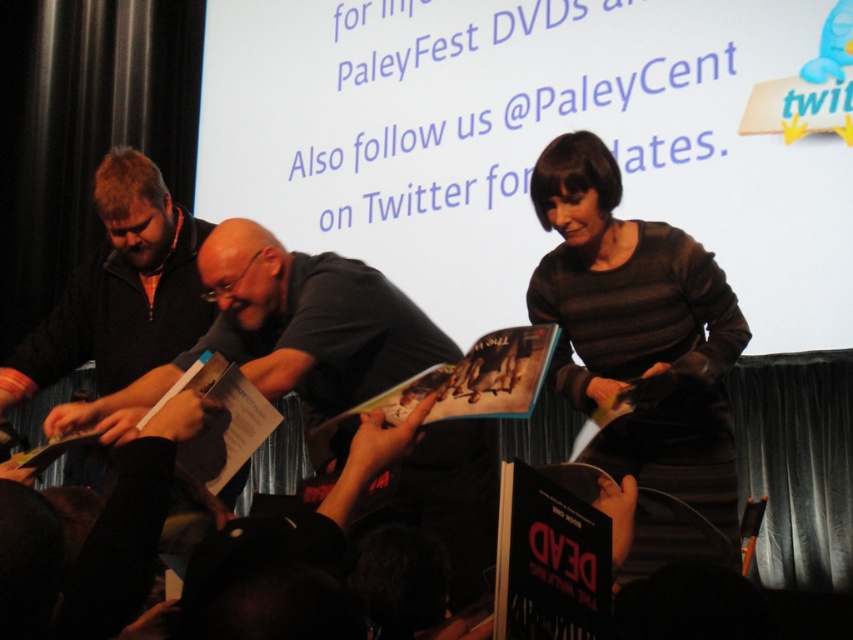
Can you confirm if dark gray striped sweater at center is positioned above hardcover book at center?

Yes, dark gray striped sweater at center is above hardcover book at center.

Is point (664, 323) more distant than point (439, 392)?

Yes, point (664, 323) is farther from viewer.

Find the location of a particular element. The width and height of the screenshot is (853, 640). dark gray striped sweater at center is located at coordinates (637, 330).

Is dark gray shirt at center below white paper book at center?

Incorrect, dark gray shirt at center is not positioned below white paper book at center.

Can you confirm if dark gray shirt at center is wider than white paper book at center?

Yes.

Who is more forward, [286,259] or [218,362]?

Point [218,362] is more forward.

At what (x,y) coordinates should I click in order to perform the action: click on dark gray shirt at center. Please return your answer as a coordinate pair (x, y). The image size is (853, 640). Looking at the image, I should click on (286, 330).

Does dark brown sweater at left have a greater height compared to hardcover book at center?

In fact, dark brown sweater at left may be shorter than hardcover book at center.

Between dark brown sweater at left and hardcover book at center, which one has less height?

dark brown sweater at left

Who is more distant from viewer, (x=146, y=250) or (x=553, y=342)?

The point (x=146, y=250) is more distant.

The width and height of the screenshot is (853, 640). I want to click on dark brown sweater at left, so click(x=120, y=289).